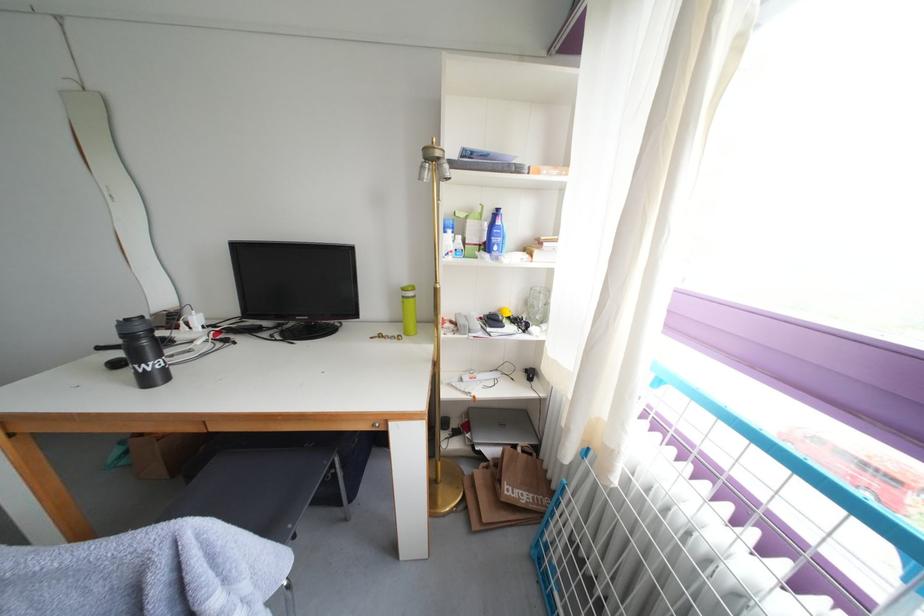
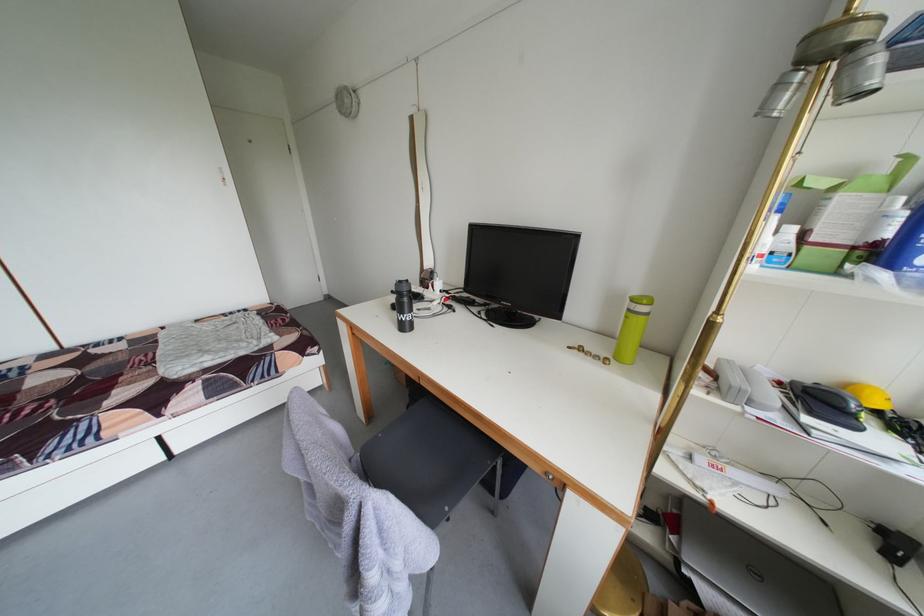
Question: Based on the continuous images, in which direction is the camera rotating? Reply with the corresponding letter.

Choices:
 (A) Left
 (B) Right
 (C) Up
 (D) Down

Answer: (A)